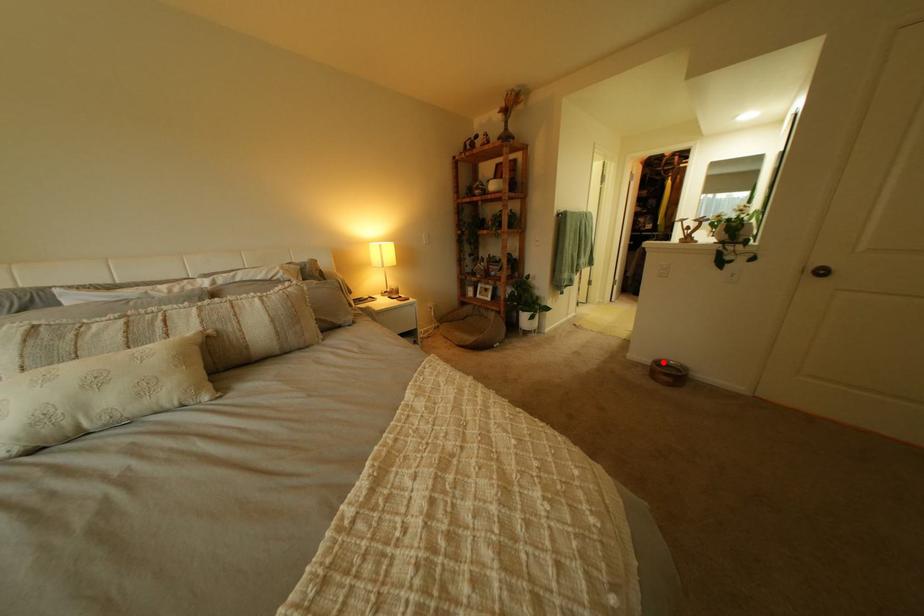
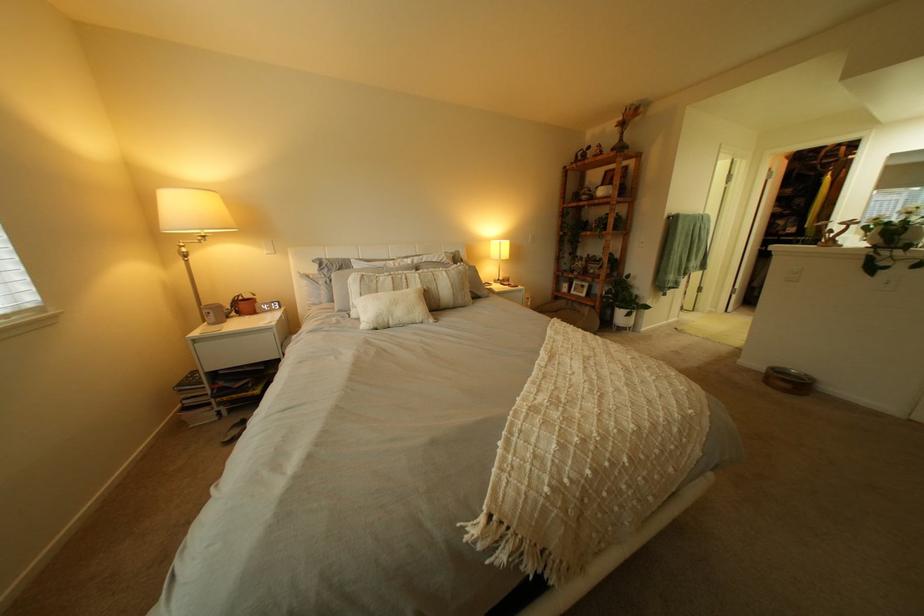
Find the pixel in the second image that matches the highlighted location in the first image.

(779, 369)